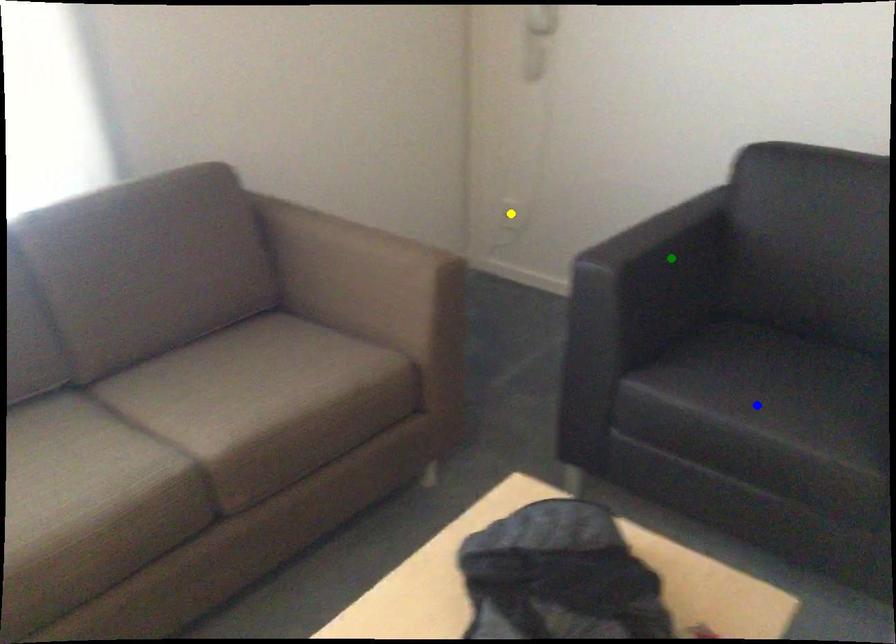
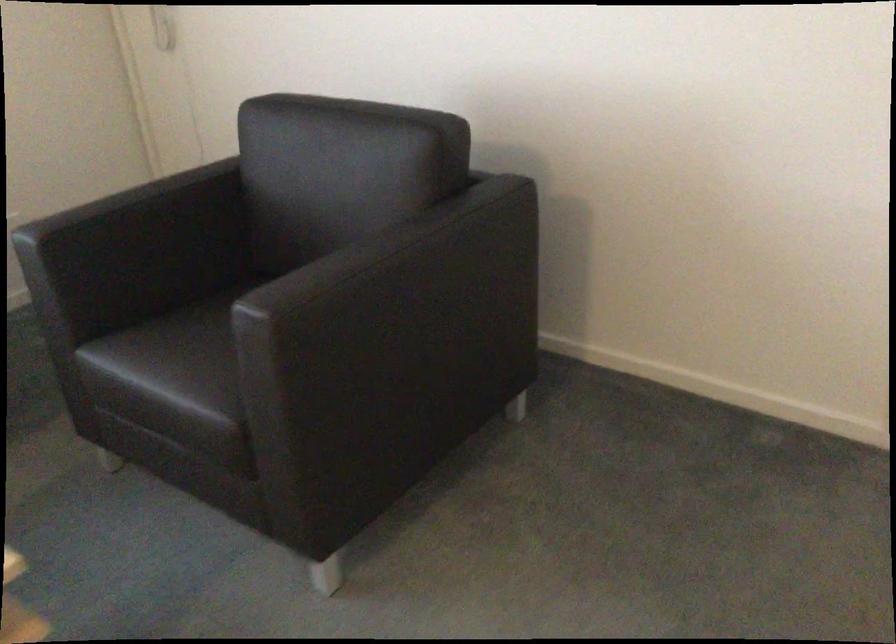
I am providing you with two images of the same scene from different viewpoints. Three points are marked in image1. Which point corresponds to a part or object that is occluded in image2?In image1, three points are marked. Which of them correspond to a part or object that is occluded in image2?Among the three points shown in image1, which one corresponds to a part or object that is no longer visible due to occlusion in image2?

yellow point cannot be seen in image2.